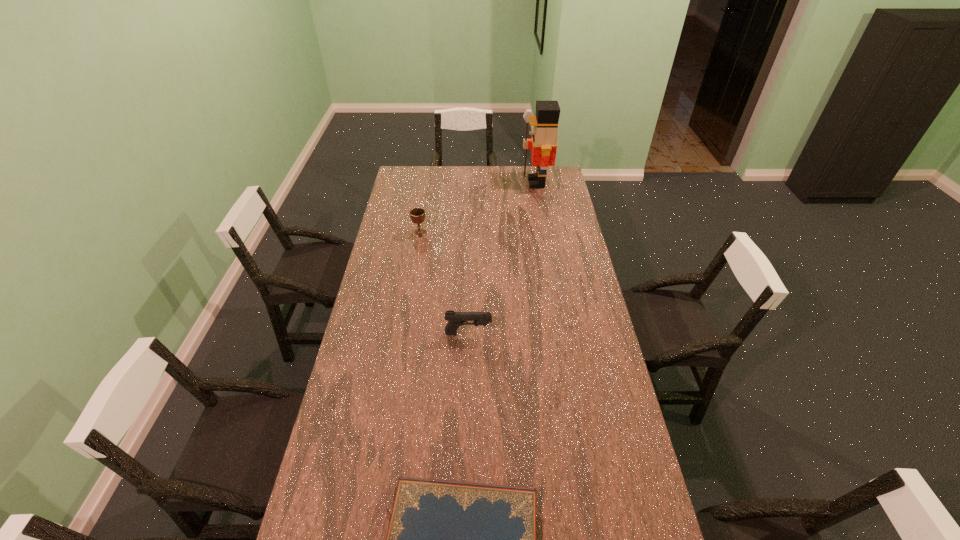
Where is `empty space that is in between the rightmost object and the third farthest object`? This screenshot has width=960, height=540. empty space that is in between the rightmost object and the third farthest object is located at coordinates (502, 258).

Where is `vacant region between the farthest object and the third nearest object`? The image size is (960, 540). vacant region between the farthest object and the third nearest object is located at coordinates (478, 208).

Image resolution: width=960 pixels, height=540 pixels. Find the location of `free point between the chalice and the third farthest object`. free point between the chalice and the third farthest object is located at coordinates (444, 284).

At what (x,y) coordinates should I click in order to perform the action: click on empty location between the chalice and the pistol. Please return your answer as a coordinate pair (x, y). The image size is (960, 540). Looking at the image, I should click on (444, 284).

Select which object is the third closest to the shortest object. Please provide its 2D coordinates. Your answer should be formatted as a tuple, i.e. [(x, y)], where the tuple contains the x and y coordinates of a point satisfying the conditions above.

[(543, 143)]

Where is `object that ranks as the closest to the leftmost object`? object that ranks as the closest to the leftmost object is located at coordinates (543, 143).